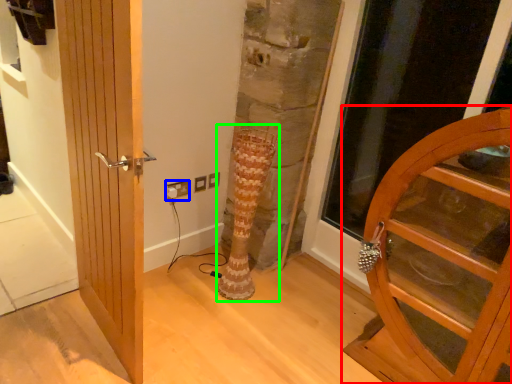
Question: Estimate the real-world distances between objects in this image. Which object is farther from door (highlighted by a red box), electric outlet (highlighted by a blue box) or tree trunk (highlighted by a green box)?

Choices:
 (A) electric outlet
 (B) tree trunk

Answer: (A)